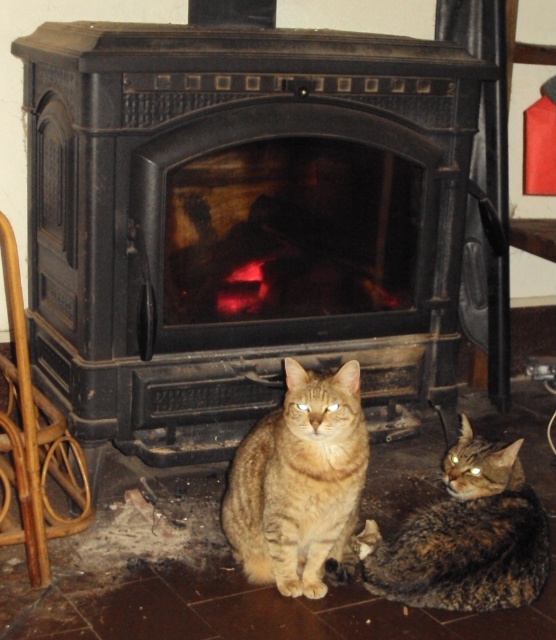
Question: Which object is the farthest from the tabby fur cat at center?

Choices:
 (A) black matte fireplace at center
 (B) tabby fur cat at lower center

Answer: (A)

Question: Is tabby fur cat at center wider than tabby fur cat at lower center?

Choices:
 (A) yes
 (B) no

Answer: (B)

Question: In this image, where is black matte fireplace at center located relative to tabby fur cat at center?

Choices:
 (A) above
 (B) below

Answer: (A)

Question: Estimate the real-world distances between objects in this image. Which object is closer to the tabby fur cat at center?

Choices:
 (A) black matte fireplace at center
 (B) tabby fur cat at lower center

Answer: (B)

Question: Is black matte fireplace at center bigger than tabby fur cat at lower center?

Choices:
 (A) no
 (B) yes

Answer: (B)

Question: Which of the following is the farthest from the observer?

Choices:
 (A) tabby fur cat at center
 (B) black matte fireplace at center
 (C) tabby fur cat at lower center

Answer: (B)